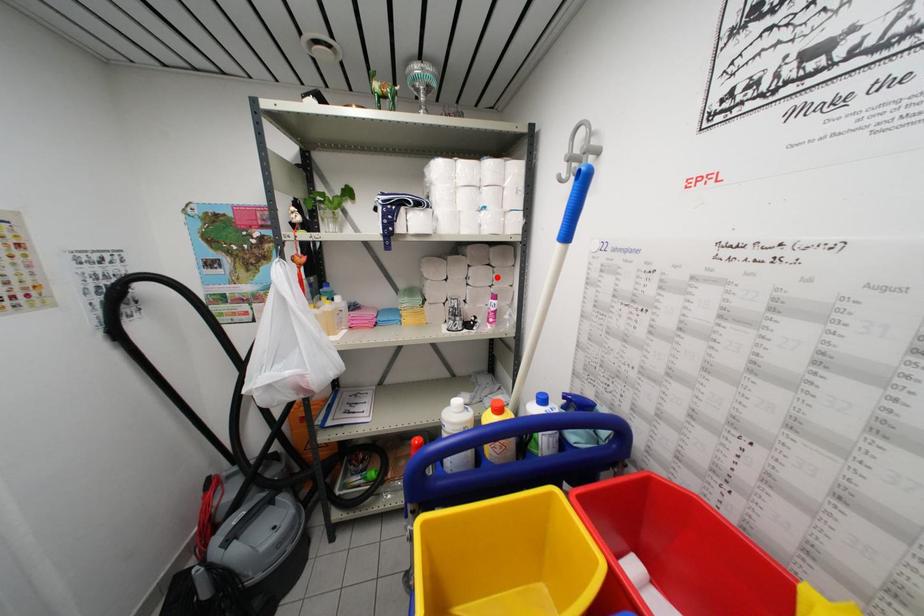
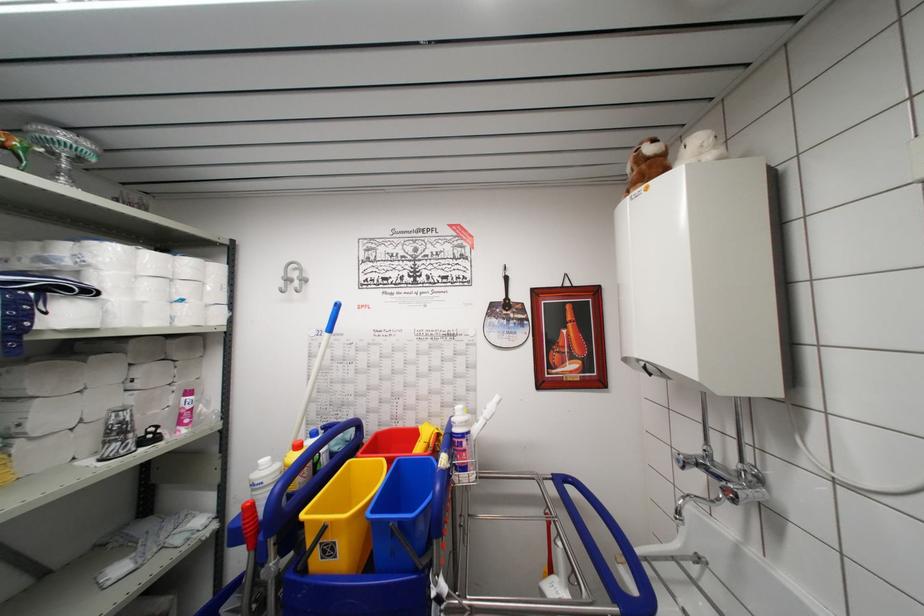
The point at the highlighted location is marked in the first image. Where is the corresponding point in the second image?

(178, 371)